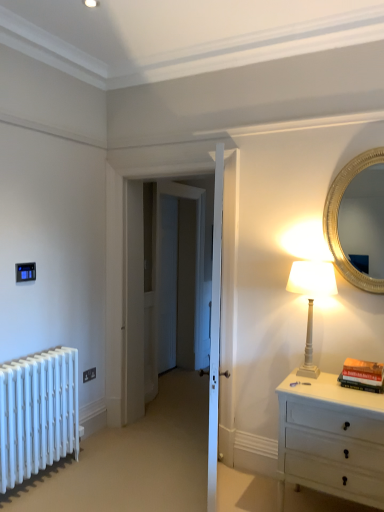
Question: Relative to white metallic radiator at lower left, is white glossy table lamp at right in front or behind?

Choices:
 (A) behind
 (B) front

Answer: (B)

Question: From the image's perspective, relative to white metallic radiator at lower left, is white glossy table lamp at right above or below?

Choices:
 (A) above
 (B) below

Answer: (A)

Question: Estimate the real-world distances between objects in this image. Which object is farther from the gold metallic mirror at upper right?

Choices:
 (A) white glossy table lamp at right
 (B) white metallic radiator at lower left
 (C) black plastic electrical outlet at lower left
 (D) white painted wood chest of drawers at right
 (E) hardcover book at right

Answer: (C)

Question: Which of these objects is positioned farthest from the white metallic radiator at lower left?

Choices:
 (A) hardcover book at right
 (B) black plastic electrical outlet at lower left
 (C) white painted wood chest of drawers at right
 (D) white glossy table lamp at right
 (E) gold metallic mirror at upper right

Answer: (E)